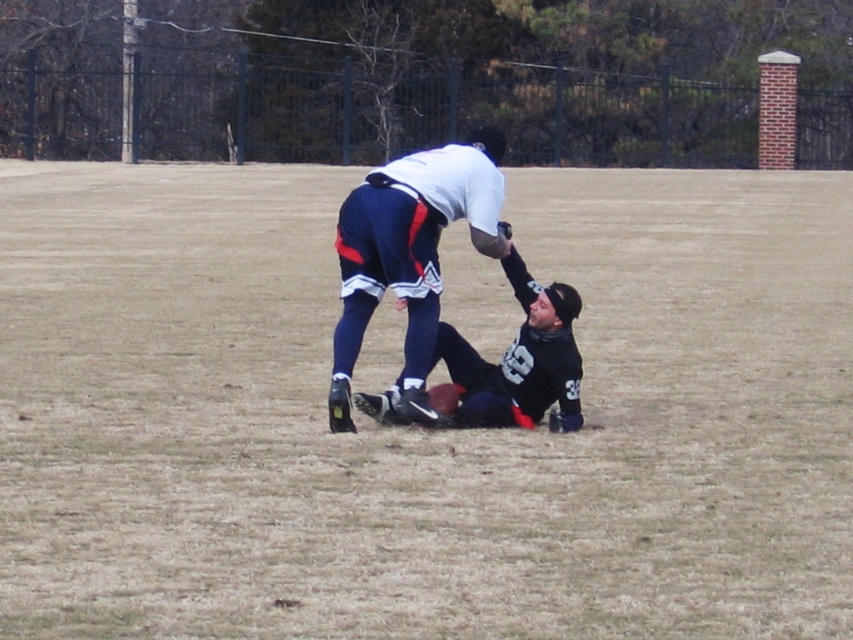
Question: From the image, what is the correct spatial relationship of white matte shirt at center in relation to black jersey at center?

Choices:
 (A) below
 (B) above

Answer: (B)

Question: Can you confirm if brown grass at center is positioned above black jersey at center?

Choices:
 (A) no
 (B) yes

Answer: (B)

Question: Is white matte shirt at center below black jersey at center?

Choices:
 (A) no
 (B) yes

Answer: (A)

Question: Among these points, which one is farthest from the camera?

Choices:
 (A) (473, 410)
 (B) (347, 364)
 (C) (757, 444)

Answer: (B)

Question: Among these objects, which one is farthest from the camera?

Choices:
 (A) brown grass at center
 (B) white matte shirt at center
 (C) black jersey at center

Answer: (C)

Question: Which of the following is the farthest from the observer?

Choices:
 (A) brown grass at center
 (B) black jersey at center
 (C) white matte shirt at center

Answer: (B)